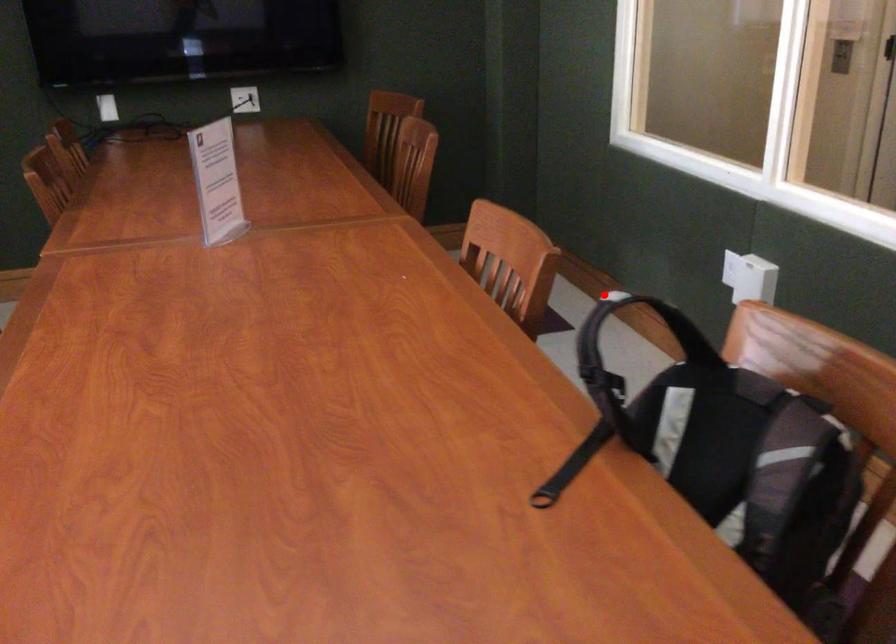
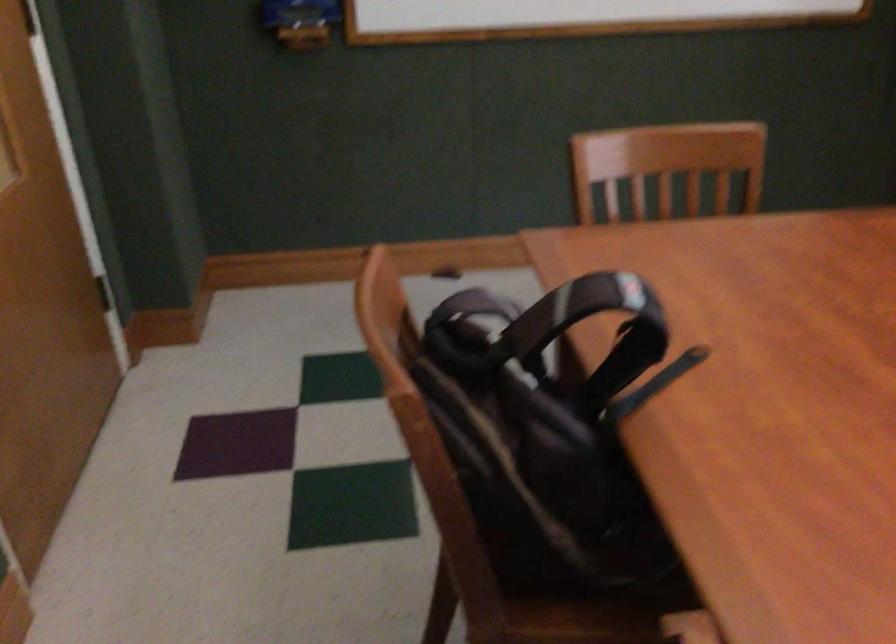
Question: I am providing you with two images of the same scene from different viewpoints. Image1 has a red point marked. In image2, the corresponding 3D location appears at what relative position? Reply with the corresponding letter.

Choices:
 (A) Closer
 (B) Farther

Answer: (A)